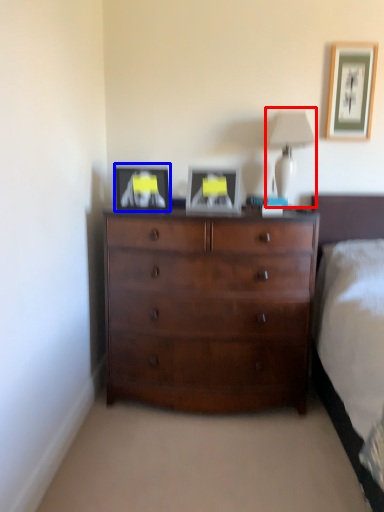
Question: Which of the following is the closest to the observer, table lamp (highlighted by a red box) or picture frame (highlighted by a blue box)?

Choices:
 (A) table lamp
 (B) picture frame

Answer: (B)